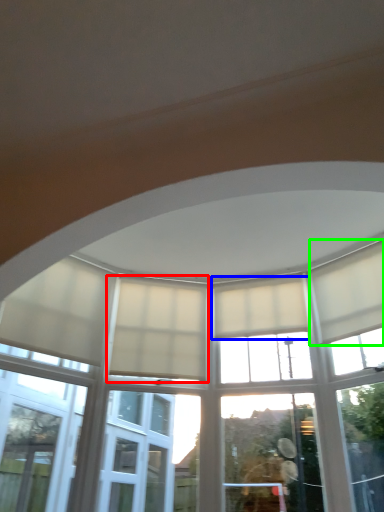
Question: Which is farther away from curtain (highlighted by a red box)? curtain (highlighted by a blue box) or curtain (highlighted by a green box)?

Choices:
 (A) curtain
 (B) curtain

Answer: (B)